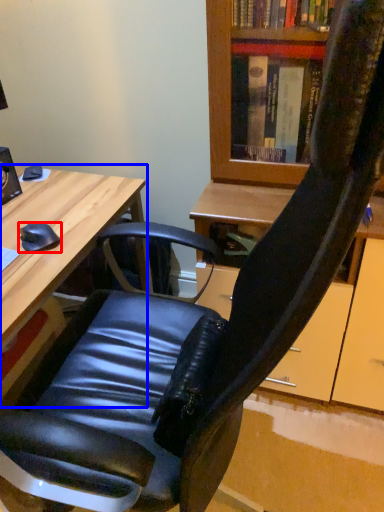
Question: Which object appears farthest to the camera in this image, mouse (highlighted by a red box) or desk (highlighted by a blue box)?

Choices:
 (A) mouse
 (B) desk

Answer: (A)